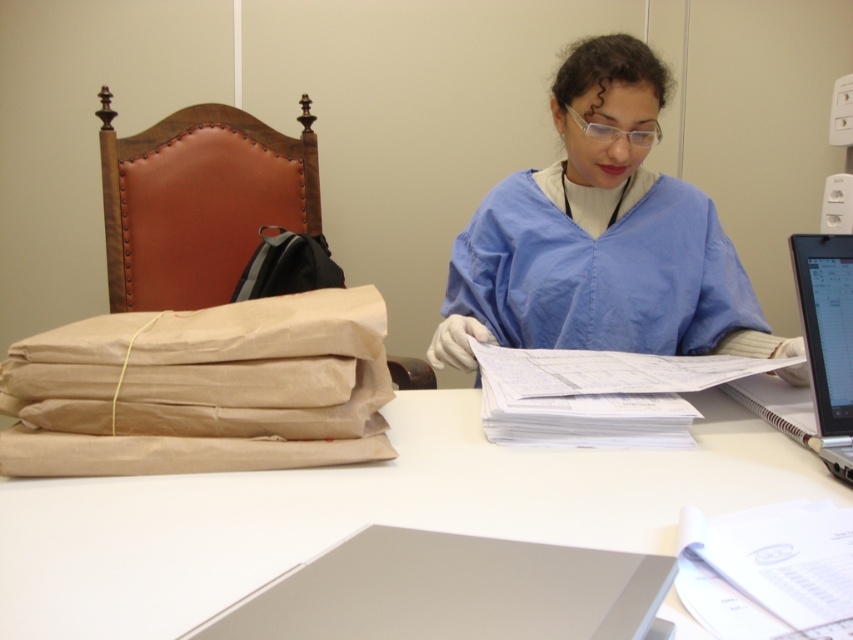
You are an assistant in a medical office. You see the blue smooth scrubs at center and the white paper at center on the desk. Which item is positioned to the right of the other?

The blue smooth scrubs at center are to the right of the white paper at center.

You are a healthcare worker entering the workspace and need to place a medical kit on the white matte table at center. However, you notice the blue smooth scrubs at center might be in the way. Based on their positions, can you place the medical kit without moving the scrubs?

The white matte table at center is located below the blue smooth scrubs at center, so placing the medical kit on the table would require moving the scrubs as they are above it and could obstruct access.

You are a healthcare worker in a busy hospital. You need to quickly assess whether your blue smooth scrubs at center can be folded and stored under the white paper at center without wrinkling. Based on their sizes, is this possible?

The blue smooth scrubs at center is larger in size than the white paper at center, so it cannot be folded and stored under the white paper at center without wrinkling.